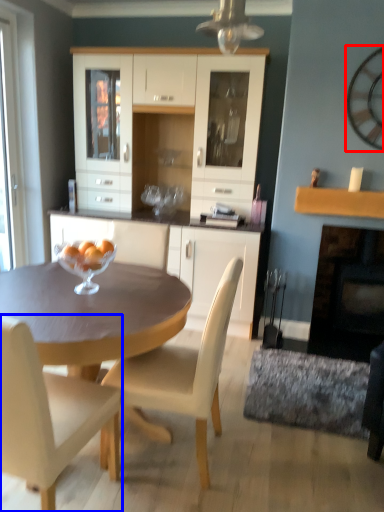
Question: Which object appears farthest to the camera in this image, clock (highlighted by a red box) or chair (highlighted by a blue box)?

Choices:
 (A) clock
 (B) chair

Answer: (A)